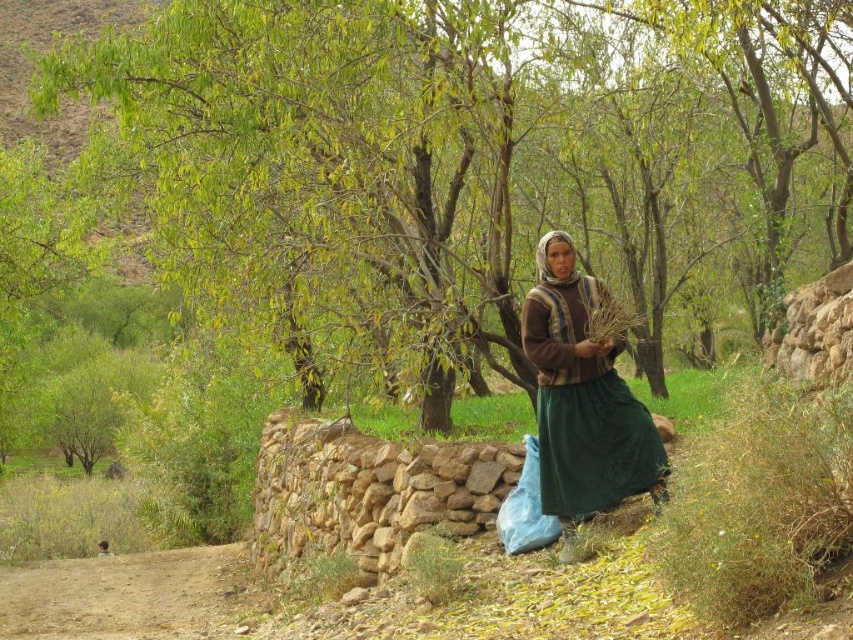
You are a hiker who wants to take a photo of the brown woven scarf at center and the green leafy tree at center. Which object should you focus on first if you want to capture both in the same frame without moving your camera?

You should focus on the brown woven scarf at center first because the green leafy tree at center is to the left of it, so adjusting the camera to include both would require framing from the scarf towards the tree on the left.

You are a hiker who wants to take a photo of the green leafy tree at center and the brown woven scarf at center. Which object should you focus on first if you want to capture both in a single frame without moving the camera?

The green leafy tree at center is larger in size than the brown woven scarf at center, so you should focus on the green leafy tree at center first to ensure it fits properly in the frame before adjusting for the smaller brown woven scarf at center.

You are a photographer trying to capture the woman in the scene. You notice the green leafy tree at center and the brown woven scarf at center. Which object is closer to you, the photographer?

The green leafy tree at center is closer to you than the brown woven scarf at center, which is positioned behind it.